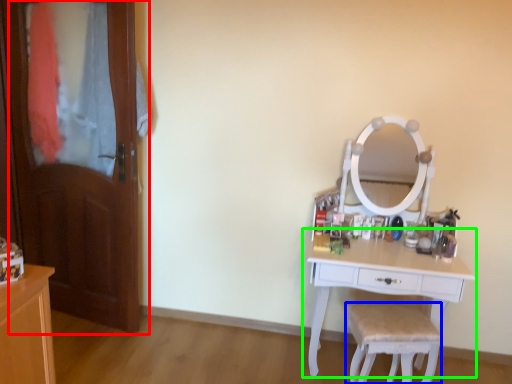
Question: Which object is positioned farthest from door (highlighted by a red box)? Select from chair (highlighted by a blue box) and table (highlighted by a green box).

Choices:
 (A) chair
 (B) table

Answer: (A)